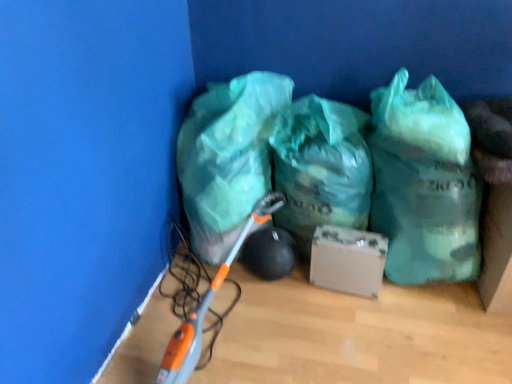
Question: Is matte cardboard box at center turned away from translucent green plastic bag at lower left, arranged as the first plastic bag when viewed from the left?

Choices:
 (A) no
 (B) yes

Answer: (A)

Question: Would you consider matte cardboard box at center to be distant from translucent green plastic bag at lower left, arranged as the first plastic bag when viewed from the left?

Choices:
 (A) no
 (B) yes

Answer: (A)

Question: Is matte cardboard box at center thinner than translucent green plastic bag at lower left, arranged as the first plastic bag when viewed from the left?

Choices:
 (A) yes
 (B) no

Answer: (A)

Question: Is translucent green plastic bag at lower left, the 3th plastic bag from the right, completely or partially inside matte cardboard box at center?

Choices:
 (A) no
 (B) yes

Answer: (A)

Question: From the image's perspective, would you say matte cardboard box at center is positioned over translucent green plastic bag at lower left, the 3th plastic bag from the right?

Choices:
 (A) no
 (B) yes

Answer: (A)

Question: Can you confirm if matte cardboard box at center is positioned to the right of translucent green plastic bag at lower left, arranged as the first plastic bag when viewed from the left?

Choices:
 (A) no
 (B) yes

Answer: (B)

Question: Can you confirm if matte cardboard box at center is thinner than green camouflage plastic bag at center, which is the third plastic bag from left to right?

Choices:
 (A) yes
 (B) no

Answer: (A)

Question: Does matte cardboard box at center come behind green camouflage plastic bag at center, which is the third plastic bag from left to right?

Choices:
 (A) no
 (B) yes

Answer: (B)

Question: Is matte cardboard box at center smaller than green camouflage plastic bag at center, which ranks as the 1th plastic bag in right-to-left order?

Choices:
 (A) no
 (B) yes

Answer: (B)

Question: Is green camouflage plastic bag at center, which ranks as the 1th plastic bag in right-to-left order, at the back of matte cardboard box at center?

Choices:
 (A) no
 (B) yes

Answer: (A)

Question: Is matte cardboard box at center with green camouflage plastic bag at center, which is the third plastic bag from left to right?

Choices:
 (A) yes
 (B) no

Answer: (B)

Question: Is matte cardboard box at center wider than green camouflage plastic bag at center, which is the third plastic bag from left to right?

Choices:
 (A) yes
 (B) no

Answer: (B)

Question: Does translucent green plastic bag at lower left, the 3th plastic bag from the right, lie behind green camouflage plastic bag at center, which is the third plastic bag from left to right?

Choices:
 (A) no
 (B) yes

Answer: (B)